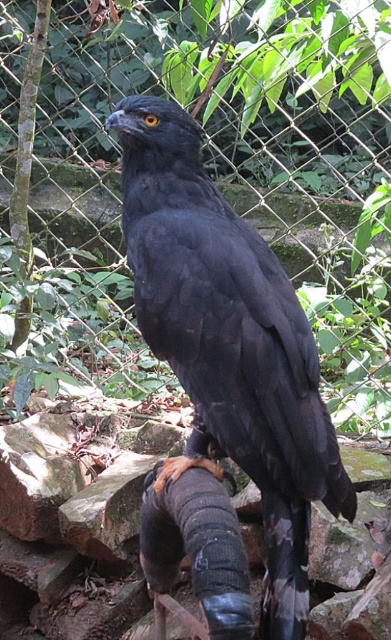
Measure the distance between wire mesh fence at center and camera.

wire mesh fence at center is 2.00 meters from camera.

Is wire mesh fence at center to the left of black matte/furred falcon at center from the viewer's perspective?

In fact, wire mesh fence at center is to the right of black matte/furred falcon at center.

Is point (105, 145) positioned behind point (188, 236)?

Yes, point (105, 145) is farther from viewer.

Where is `wire mesh fence at center`? wire mesh fence at center is located at coordinates (222, 115).